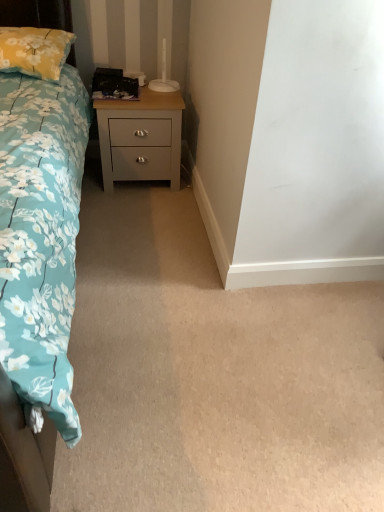
Question: Is yellow floral pillow at upper left aimed at satin gray wood nightstand at center?

Choices:
 (A) no
 (B) yes

Answer: (A)

Question: Is yellow floral pillow at upper left beside satin gray wood nightstand at center?

Choices:
 (A) no
 (B) yes

Answer: (A)

Question: Is yellow floral pillow at upper left shorter than satin gray wood nightstand at center?

Choices:
 (A) yes
 (B) no

Answer: (A)

Question: Considering the relative sizes of yellow floral pillow at upper left and satin gray wood nightstand at center in the image provided, is yellow floral pillow at upper left thinner than satin gray wood nightstand at center?

Choices:
 (A) yes
 (B) no

Answer: (B)

Question: Considering the relative sizes of yellow floral pillow at upper left and satin gray wood nightstand at center in the image provided, is yellow floral pillow at upper left smaller than satin gray wood nightstand at center?

Choices:
 (A) no
 (B) yes

Answer: (B)

Question: Do you think yellow floral pillow at upper left is within satin gray wood nightstand at center, or outside of it?

Choices:
 (A) inside
 (B) outside

Answer: (B)

Question: Considering the positions of point (11, 52) and point (145, 126), is point (11, 52) closer or farther from the camera than point (145, 126)?

Choices:
 (A) farther
 (B) closer

Answer: (B)

Question: Looking at the image, does yellow floral pillow at upper left seem bigger or smaller compared to satin gray wood nightstand at center?

Choices:
 (A) big
 (B) small

Answer: (B)

Question: From a real-world perspective, is yellow floral pillow at upper left positioned above or below satin gray wood nightstand at center?

Choices:
 (A) above
 (B) below

Answer: (A)

Question: From a real-world perspective, relative to blue floral fabric bed at left, is satin gray wood nightstand at center vertically above or below?

Choices:
 (A) above
 (B) below

Answer: (B)

Question: Considering the positions of satin gray wood nightstand at center and blue floral fabric bed at left in the image, is satin gray wood nightstand at center taller or shorter than blue floral fabric bed at left?

Choices:
 (A) tall
 (B) short

Answer: (B)

Question: Considering the positions of satin gray wood nightstand at center and blue floral fabric bed at left in the image, is satin gray wood nightstand at center wider or thinner than blue floral fabric bed at left?

Choices:
 (A) wide
 (B) thin

Answer: (B)

Question: Considering the positions of point (168, 113) and point (34, 485), is point (168, 113) closer or farther from the camera than point (34, 485)?

Choices:
 (A) closer
 (B) farther

Answer: (B)

Question: Is satin gray wood nightstand at center bigger or smaller than yellow floral pillow at upper left?

Choices:
 (A) big
 (B) small

Answer: (A)

Question: Looking at their shapes, would you say satin gray wood nightstand at center is wider or thinner than yellow floral pillow at upper left?

Choices:
 (A) wide
 (B) thin

Answer: (B)